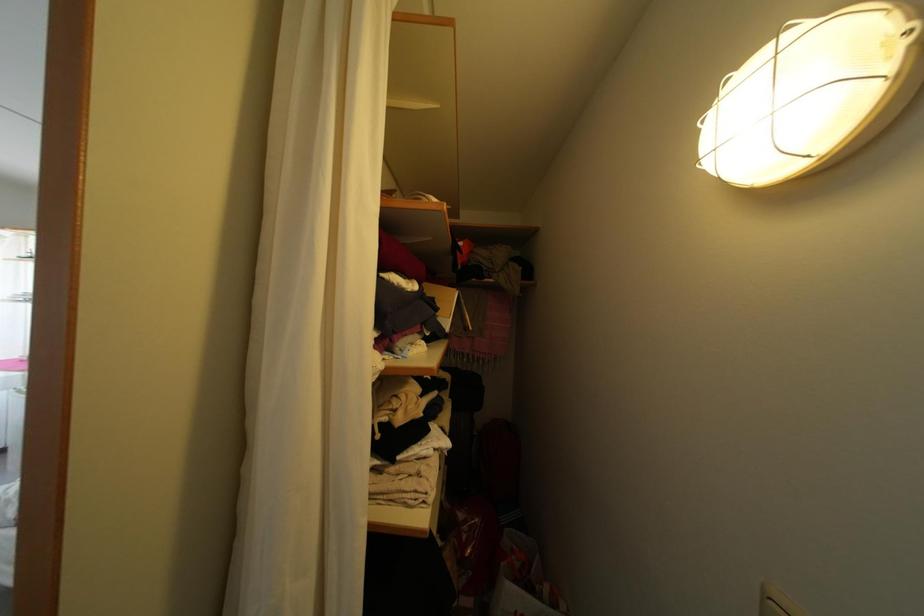
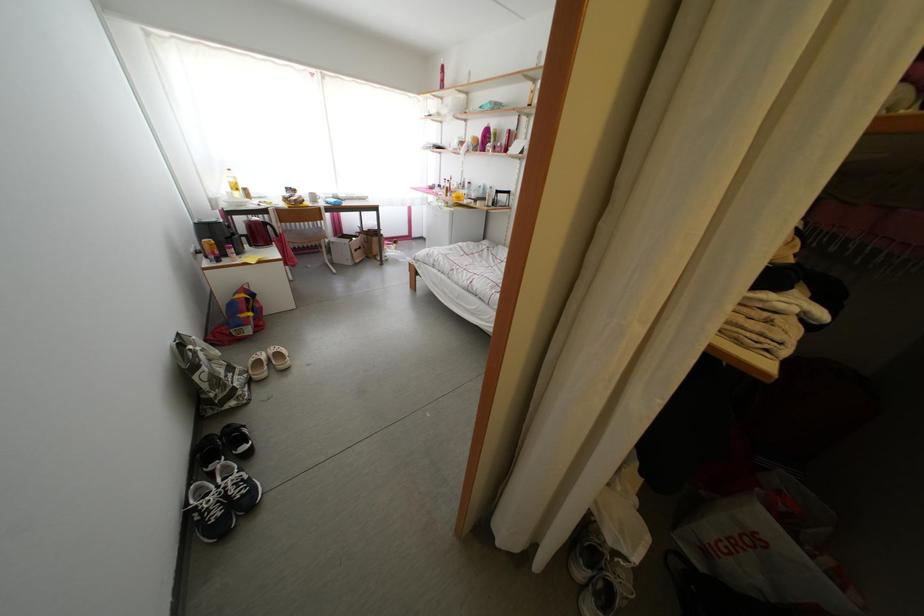
Based on the continuous images, in which direction is the camera rotating?

The camera's rotation is toward left-down.